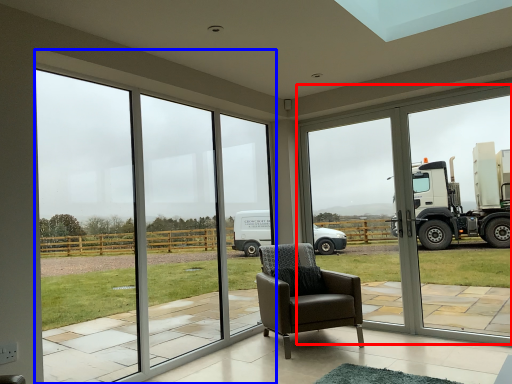
Question: Among these objects, which one is farthest to the camera, window frame (highlighted by a red box) or window (highlighted by a blue box)?

Choices:
 (A) window frame
 (B) window

Answer: (A)